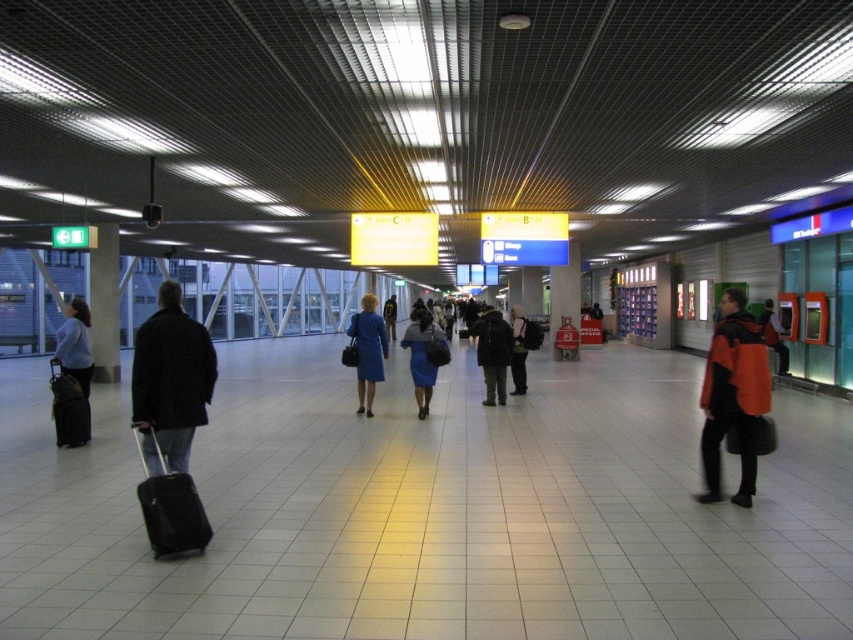
Does black fabric suitcase at left have a lesser width compared to orange jacket at right?

Yes, black fabric suitcase at left is thinner than orange jacket at right.

Is black fabric suitcase at left bigger than orange jacket at right?

Actually, black fabric suitcase at left might be smaller than orange jacket at right.

I want to click on black fabric suitcase at left, so click(x=68, y=406).

Does point (115, 376) come closer to viewer compared to point (416, 355)?

No, (115, 376) is behind (416, 355).

Consider the image. Between matte gray pillar at left and blue fabric skirt at center, which one appears on the left side from the viewer's perspective?

Positioned to the left is matte gray pillar at left.

Which is behind, point (99, 273) or point (419, 342)?

Point (99, 273)

This screenshot has height=640, width=853. Find the location of `matte gray pillar at left`. matte gray pillar at left is located at coordinates (103, 301).

Between dark gray jacket at center and blue fabric coat at center, which one appears on the left side from the viewer's perspective?

blue fabric coat at center

Which of these two, dark gray jacket at center or blue fabric coat at center, stands shorter?

Standing shorter between the two is dark gray jacket at center.

Find the location of a particular element. dark gray jacket at center is located at coordinates (492, 353).

The image size is (853, 640). In order to click on dark gray jacket at center in this screenshot , I will do `click(492, 353)`.